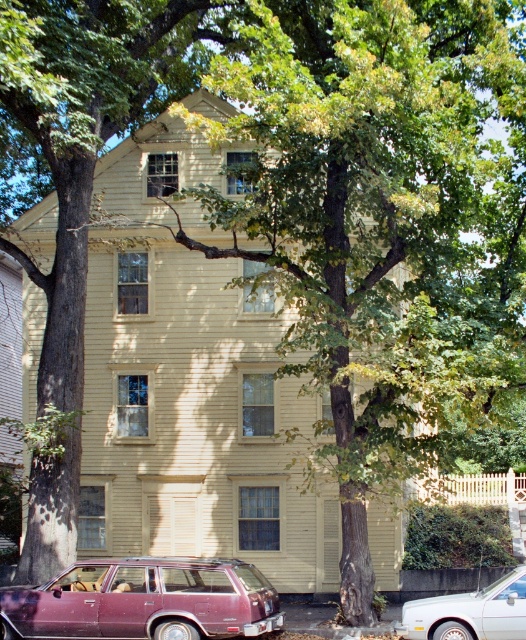
You are standing in front of the house and want to park your car between the maroon metallic station wagon at lower left and the white glossy sedan at lower right. Is there enough space for your car, which is 5 meters long?

The maroon metallic station wagon at lower left is below the white glossy sedan at lower right, but this describes their vertical positioning. Since the cars are parked parallel to the curb, the distance between them horizontally isn not specified. Without information about the horizontal spacing, it is impossible to determine if there is enough space for a 5 meter car between them.

You are standing in front of the light yellow residential building and want to park your car. The maroon metallic station wagon at lower left is already parked. Where should you park your car to avoid blocking the driveway?

The maroon metallic station wagon at lower left is located at point (145, 600), so you should park your car away from that location to avoid blocking the driveway.